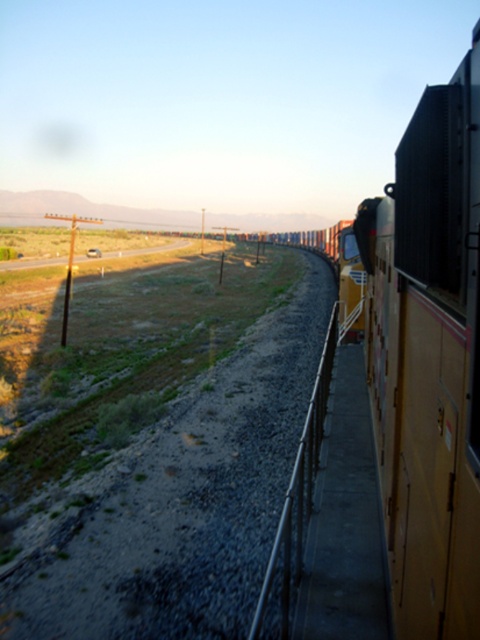
Measure the distance between metal/rusty rail at center and camera.

metal/rusty rail at center and camera are 2.16 meters apart from each other.

Can you confirm if metal/rusty rail at center is smaller than transparent glass train window at right?

No.

Which is behind, point (308, 458) or point (348, 259)?

Positioned behind is point (348, 259).

Locate an element on the screen. metal/rusty rail at center is located at coordinates (296, 508).

Which is more to the left, metallic brown train car at right or metal/rusty rail at center?

metal/rusty rail at center

Is metallic brown train car at right wider than metal/rusty rail at center?

Yes, metallic brown train car at right is wider than metal/rusty rail at center.

Which is behind, point (423, 259) or point (277, 548)?

Positioned behind is point (277, 548).

I want to click on metallic brown train car at right, so click(x=429, y=358).

Who is more forward, [455,179] or [356,253]?

Point [455,179] is more forward.

Between metallic brown train car at right and transparent glass train window at right, which one is positioned higher?

Positioned higher is transparent glass train window at right.

Is point (384, 468) behind point (349, 250)?

No, it is in front of (349, 250).

You are a GUI agent. You are given a task and a screenshot of the screen. Output one action in this format:
    pyautogui.click(x=<x>, y=<y>)
    Task: Click on the metallic brown train car at right
    The image size is (480, 640).
    Given the screenshot: What is the action you would take?
    pyautogui.click(x=429, y=358)